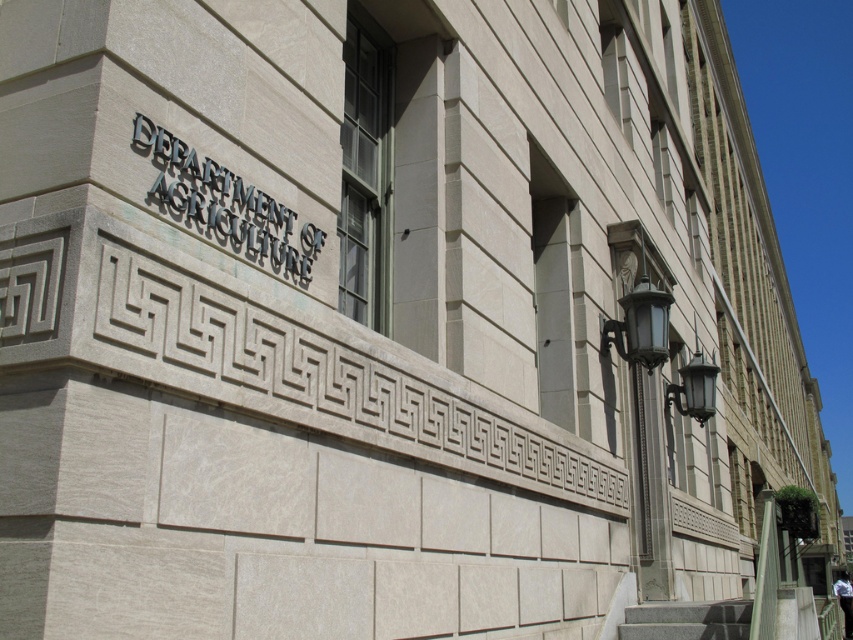
You are standing at the entrance of the DEPARTMENT OF AGRICULTURE building and want to locate the black polished metal sign at upper center and the gray granite stairs at lower right. From your current position, which object is higher in elevation?

The black polished metal sign at upper center is above the gray granite stairs at lower right, so it is higher in elevation.

You are standing in front of the DEPARTMENT OF AGRICULTURE building and want to determine the relative positions of two points marked on the facade. The first point is at coordinate point (310,275) and the second is at point (706,637). Which point appears closer to you when observing the building?

Point (310,275) is closer to the viewer than point (706,637), so the first point appears closer when observing the building.

You are a maintenance worker needing to replace a light fixture. You see the black polished metal sign at upper center and the gray granite stairs at lower right. Which object is taller and requires a ladder to reach?

The black polished metal sign at upper center is taller than the gray granite stairs at lower right, so you would need a ladder to reach it for maintenance.